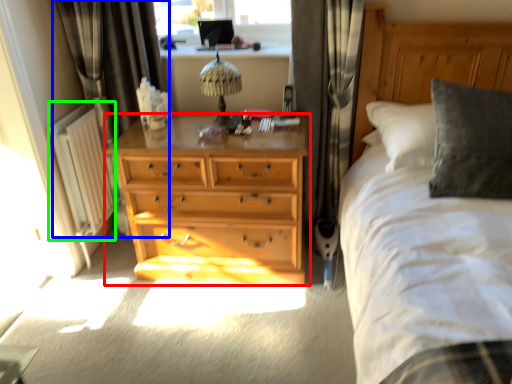
Question: Which object is positioned closest to chest of drawers (highlighted by a red box)? Select from curtain (highlighted by a blue box) and radiator (highlighted by a green box).

Choices:
 (A) curtain
 (B) radiator

Answer: (B)